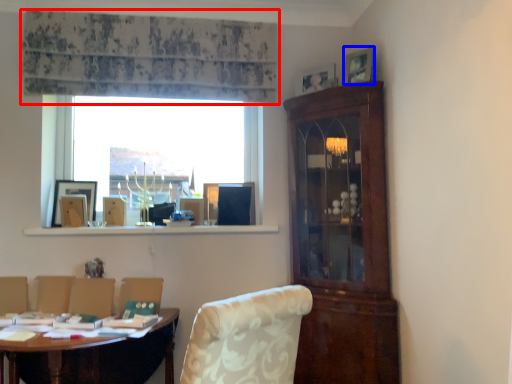
Question: Which object is further to the camera taking this photo, curtain (highlighted by a red box) or picture frame (highlighted by a blue box)?

Choices:
 (A) curtain
 (B) picture frame

Answer: (A)